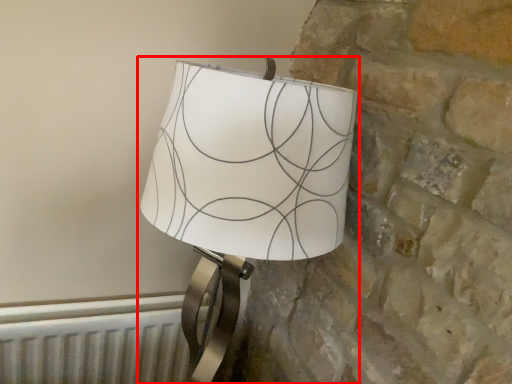
Question: Considering the relative positions of lamp (annotated by the red box) and radiator in the image provided, where is lamp (annotated by the red box) located with respect to the staircase?

Choices:
 (A) right
 (B) left

Answer: (A)